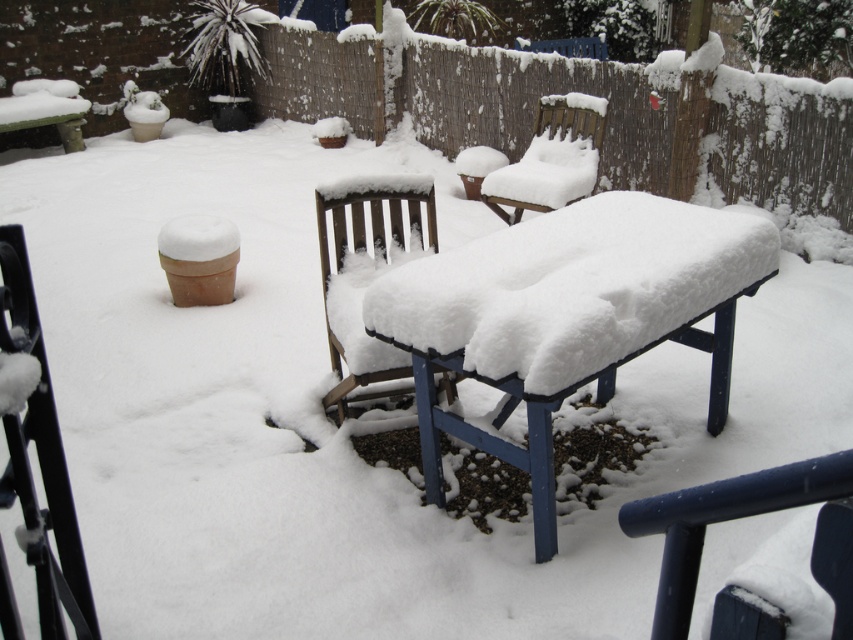
Who is lower down, brown wooden fence at upper center or black metal chair at lower left?

black metal chair at lower left is below.

Where is `brown wooden fence at upper center`? This screenshot has width=853, height=640. brown wooden fence at upper center is located at coordinates (534, 106).

Locate an element on the screen. brown wooden fence at upper center is located at coordinates [534, 106].

Is point (686, 260) behind point (410, 204)?

No, it is not.

Is blue painted wood picnic table at center smaller than wooden chair at center?

No, blue painted wood picnic table at center is not smaller than wooden chair at center.

Who is more distant from viewer, (x=390, y=305) or (x=358, y=333)?

The point (x=358, y=333) is behind.

I want to click on blue painted wood picnic table at center, so click(567, 316).

Is point (744, 77) positioned after point (548, 157)?

No, (744, 77) is in front of (548, 157).

From the picture: Measure the distance between brown wooden fence at upper center and camera.

brown wooden fence at upper center and camera are 5.18 meters apart.

Where is `brown wooden fence at upper center`? brown wooden fence at upper center is located at coordinates click(x=534, y=106).